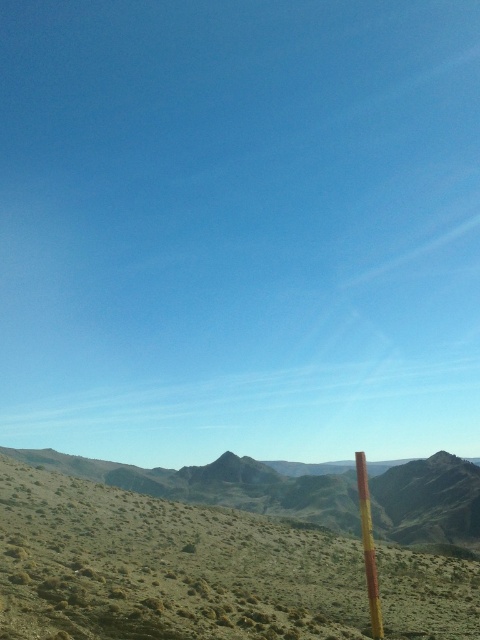
Question: Is green grassy desert at lower left to the left of yellow wood pole at right from the viewer's perspective?

Choices:
 (A) yes
 (B) no

Answer: (A)

Question: Is green grassy desert at lower left smaller than yellow wood pole at right?

Choices:
 (A) no
 (B) yes

Answer: (B)

Question: Is green grassy desert at lower left positioned at the back of yellow wood pole at right?

Choices:
 (A) no
 (B) yes

Answer: (A)

Question: Among these points, which one is nearest to the camera?

Choices:
 (A) (x=377, y=616)
 (B) (x=31, y=582)

Answer: (B)